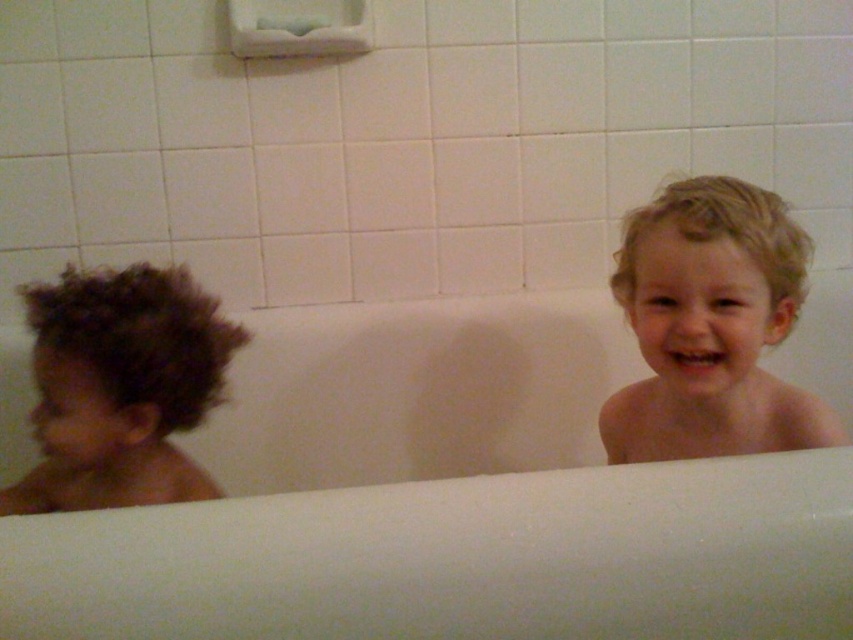
Question: Which is nearer to the dark curly hair at left?

Choices:
 (A) white smooth bathtub at center
 (B) blonde hair at right

Answer: (A)

Question: Which of these objects is positioned farthest from the blonde hair at right?

Choices:
 (A) dark curly hair at left
 (B) white smooth bathtub at center

Answer: (A)

Question: Is white smooth bathtub at center wider than dark curly hair at left?

Choices:
 (A) no
 (B) yes

Answer: (B)

Question: Which of these objects is positioned closest to the blonde hair at right?

Choices:
 (A) white smooth bathtub at center
 (B) dark curly hair at left

Answer: (A)

Question: Can you confirm if white smooth bathtub at center is bigger than blonde hair at right?

Choices:
 (A) yes
 (B) no

Answer: (B)

Question: Does white smooth bathtub at center appear over blonde hair at right?

Choices:
 (A) no
 (B) yes

Answer: (A)